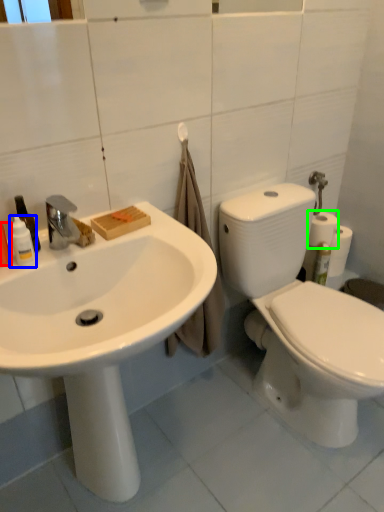
Question: Estimate the real-world distances between objects in this image. Which object is closer to cleaning product (highlighted by a red box), toiletry (highlighted by a blue box) or toilet paper (highlighted by a green box)?

Choices:
 (A) toiletry
 (B) toilet paper

Answer: (A)